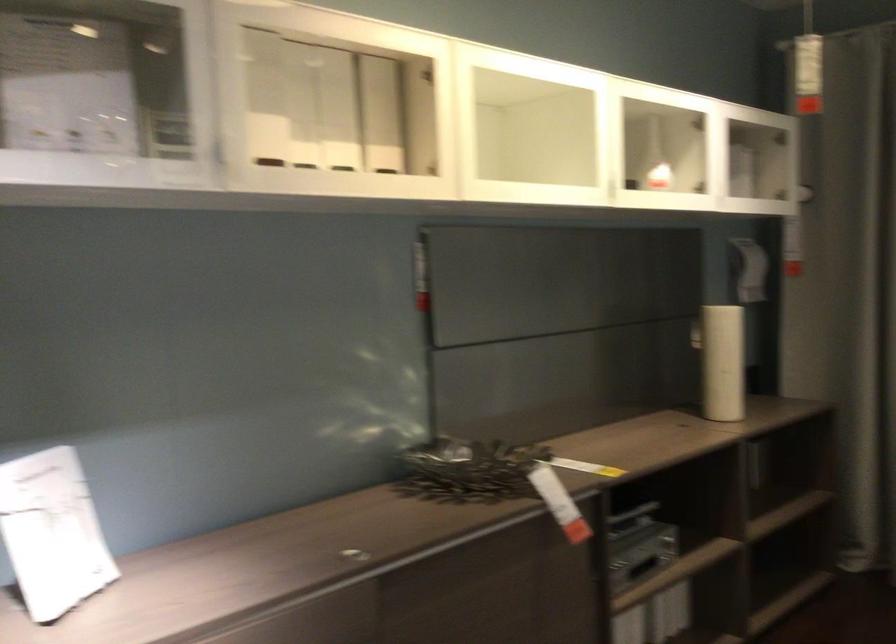
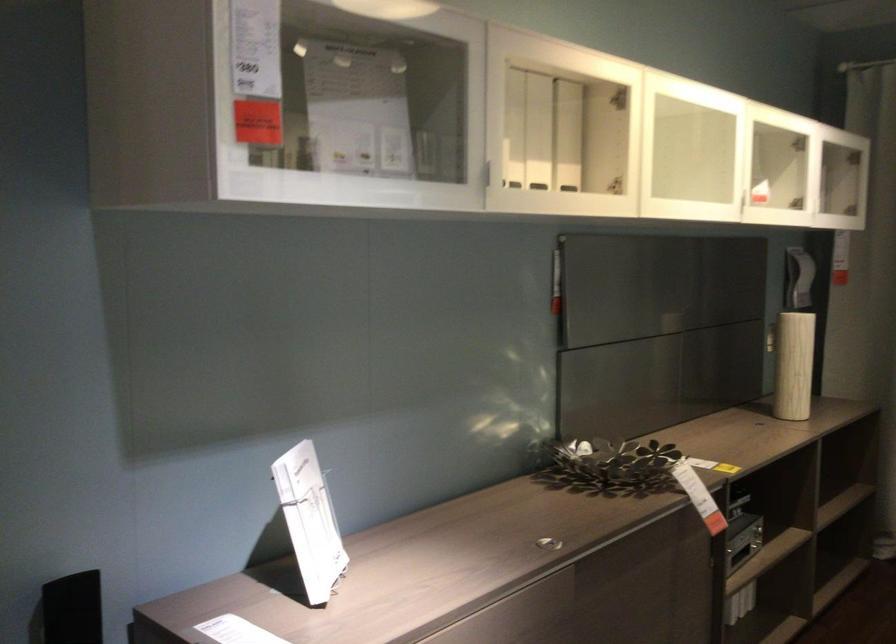
The point at (702, 330) is marked in the first image. Where is the corresponding point in the second image?

(770, 339)